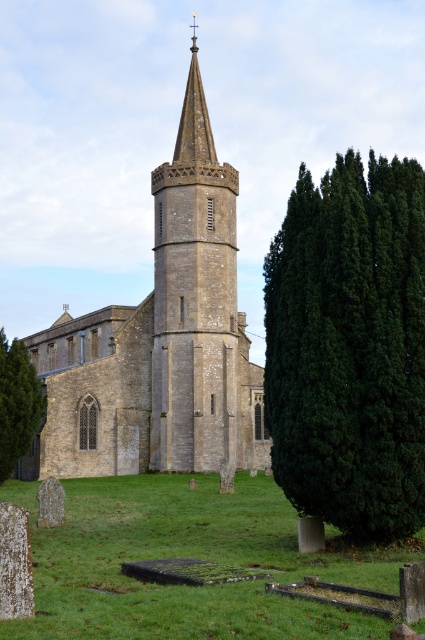
Is stone church at center below white textured stone gravestone at lower left?

Incorrect, stone church at center is not positioned below white textured stone gravestone at lower left.

Which is behind, point (68, 417) or point (16, 540)?

The point (68, 417) is behind.

This screenshot has width=425, height=640. Find the location of `stone church at center`. stone church at center is located at coordinates (161, 340).

Can you confirm if stone church at center is smaller than green grass at lower center?

No.

Does point (180, 129) come closer to viewer compared to point (147, 609)?

No.

Is point (161, 333) behind point (201, 586)?

Yes, it is behind point (201, 586).

You are a GUI agent. You are given a task and a screenshot of the screen. Output one action in this format:
    pyautogui.click(x=<x>, y=<y>)
    Task: Click on the stone church at center
    
    Given the screenshot: What is the action you would take?
    pyautogui.click(x=161, y=340)

Can you confirm if green grass at lower center is bigger than green textured tree at lower left?

Correct, green grass at lower center is larger in size than green textured tree at lower left.

Between green grass at lower center and green textured tree at lower left, which one appears on the right side from the viewer's perspective?

Positioned to the right is green grass at lower center.

Does point (382, 552) come behind point (10, 348)?

No, it is in front of (10, 348).

Locate an element on the screen. Image resolution: width=425 pixels, height=640 pixels. green grass at lower center is located at coordinates (184, 556).